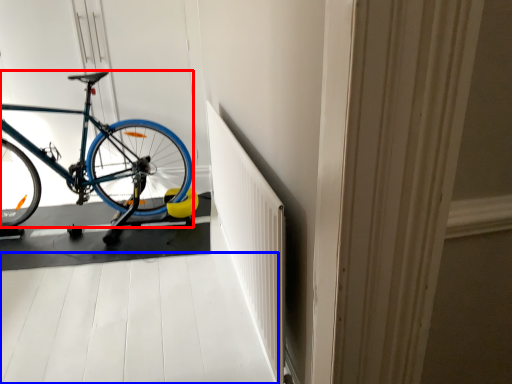
Question: Which object is closer to the camera taking this photo, bicycle (highlighted by a red box) or path (highlighted by a blue box)?

Choices:
 (A) bicycle
 (B) path

Answer: (B)